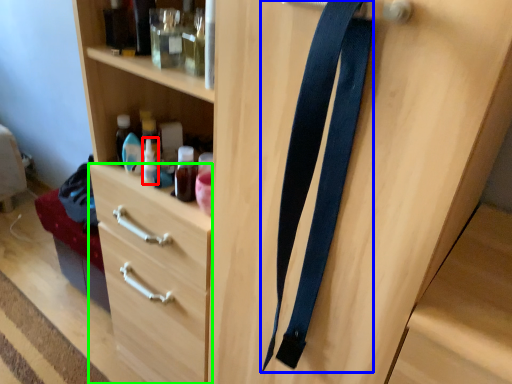
Question: Considering the real-world distances, which object is closest to bottle (highlighted by a red box)? suspenders (highlighted by a blue box) or drawer (highlighted by a green box).

Choices:
 (A) suspenders
 (B) drawer

Answer: (B)